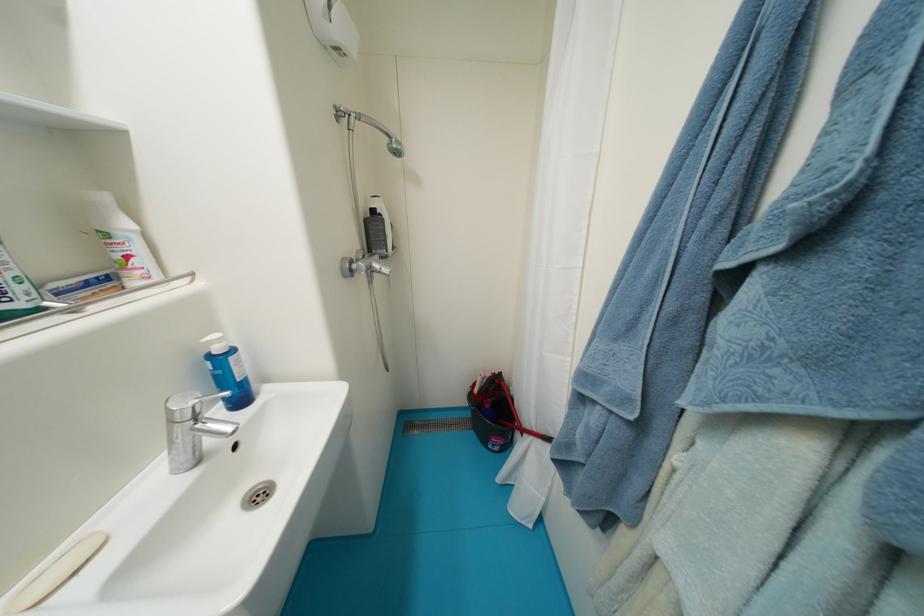
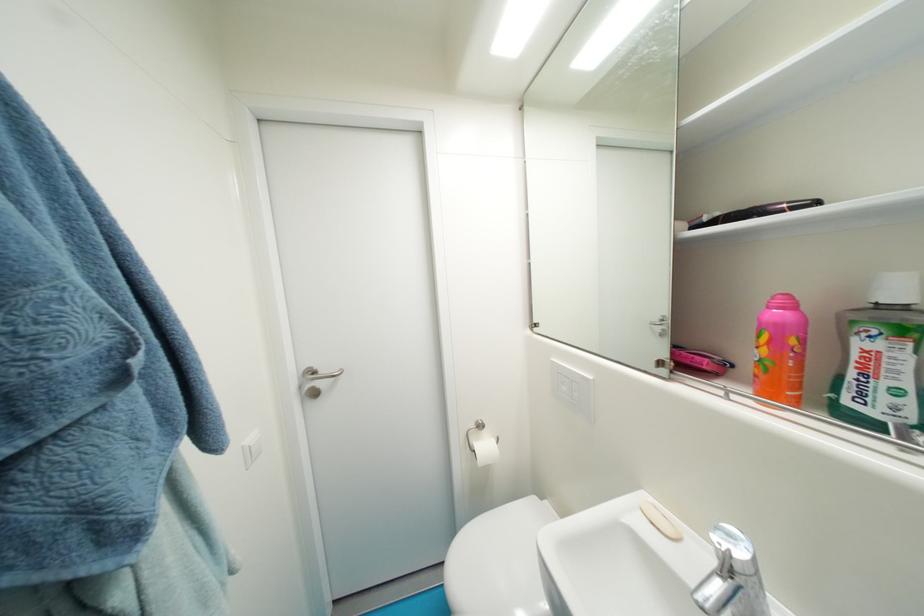
In the second image, find the point that corresponds to point 82,575 in the first image.

(659, 525)